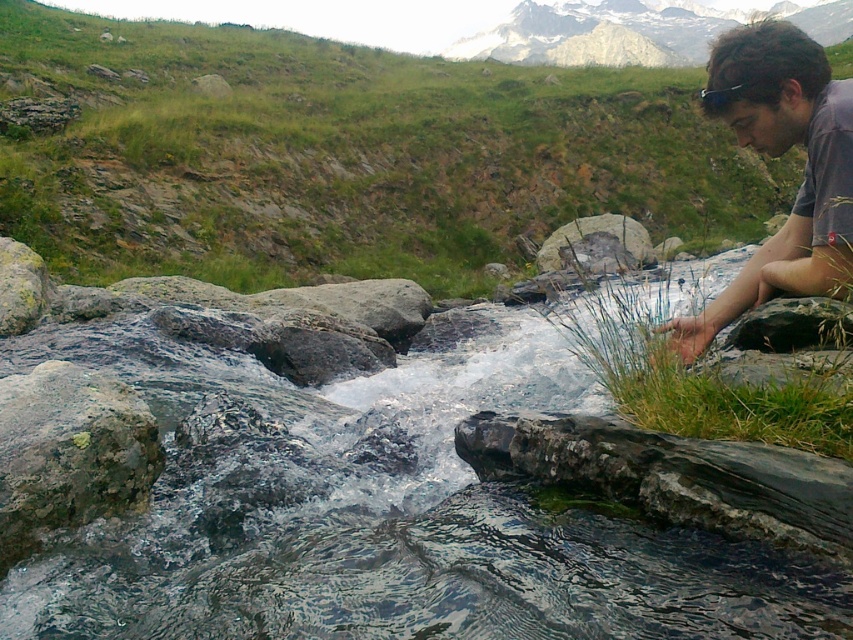
You are standing at the origin point of the image. Which direction should you move to reach the green grass at right?

The green grass at right is located at coordinates point (699, 381), so you should move towards the right and upward to reach it.